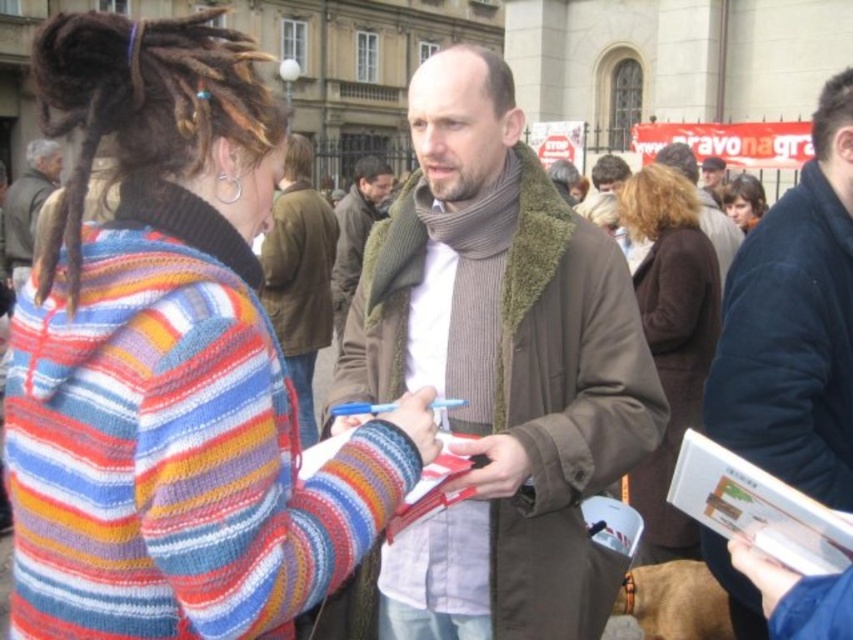
You are a photographer standing in front of the classical building and want to capture a clear photo of the striped sweater at center and the knitted scarf at center. Which object should you focus on first to ensure both are in focus?

You should focus on the striped sweater at center first because it is closer to the viewer than the knitted scarf at center, so adjusting the focus from near to far will help both objects be in focus.

You are a fashion designer observing the knitted wool sweater at center and the brown wool scarf at center. Which item is positioned lower on the person?

The knitted wool sweater at center is positioned lower than the brown wool scarf at center.

You are a photographer standing at the scene described. You want to take a photo that includes both the knitted wool sweater at center and the brown wool scarf at center. Given that your camera has a maximum focus range of 10 meters, will you be able to capture both items clearly in the same photo?

The knitted wool sweater at center is 9.75 meters away from the brown wool scarf at center. Since the distance between them is within the camera maximum focus range of 10 meters, you can capture both items clearly in the same photo.